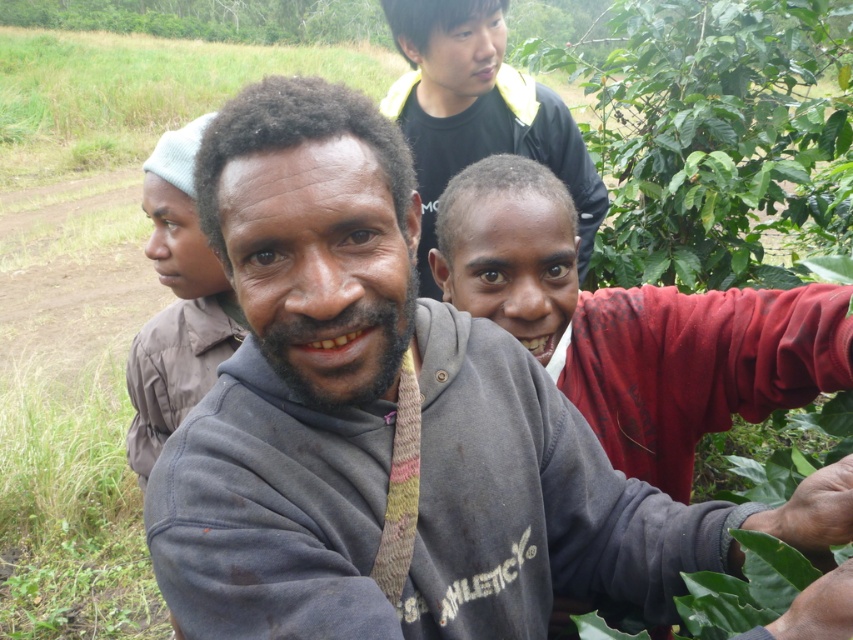
Question: Can you confirm if gray cotton hoodie at lower right is thinner than black matte shirt at upper center?

Choices:
 (A) no
 (B) yes

Answer: (B)

Question: Is the position of gray sweatshirt at center more distant than that of gray cotton hoodie at lower right?

Choices:
 (A) yes
 (B) no

Answer: (B)

Question: Is black matte shirt at upper center to the right of brown cotton shirt at center from the viewer's perspective?

Choices:
 (A) no
 (B) yes

Answer: (B)

Question: Among these points, which one is farthest from the camera?

Choices:
 (A) (440, 225)
 (B) (390, 612)

Answer: (A)

Question: Which point appears farthest from the camera in this image?

Choices:
 (A) (440, 80)
 (B) (596, 461)

Answer: (A)

Question: Which object appears farthest from the camera in this image?

Choices:
 (A) gray cotton hoodie at lower right
 (B) brown cotton shirt at center

Answer: (A)